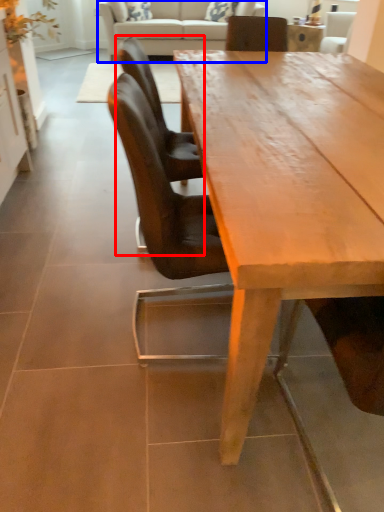
Question: Which object is closer to the camera taking this photo, chair (highlighted by a red box) or studio couch (highlighted by a blue box)?

Choices:
 (A) chair
 (B) studio couch

Answer: (A)